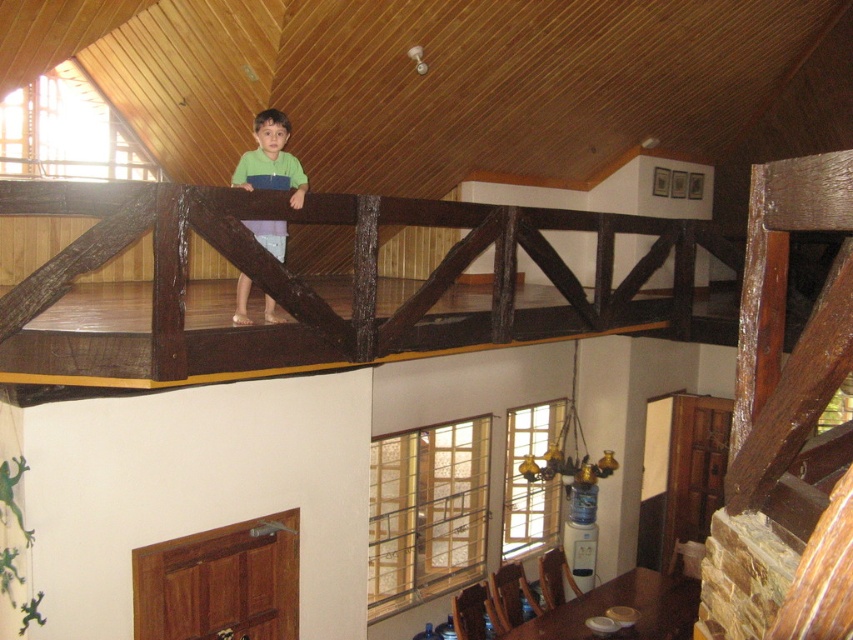
Question: Among these points, which one is farthest from the camera?

Choices:
 (A) (265, 305)
 (B) (392, 216)

Answer: (A)

Question: Can you confirm if dark brown wood at upper center is smaller than green matte shirt at upper center?

Choices:
 (A) yes
 (B) no

Answer: (B)

Question: Can you confirm if dark brown wood at upper center is positioned to the right of green matte shirt at upper center?

Choices:
 (A) no
 (B) yes

Answer: (B)

Question: Which point appears closest to the camera in this image?

Choices:
 (A) (682, 262)
 (B) (268, 144)

Answer: (B)

Question: Which point is farther from the camera taking this photo?

Choices:
 (A) (260, 225)
 (B) (219, 353)

Answer: (A)

Question: Does dark brown wood at upper center have a lesser width compared to green matte shirt at upper center?

Choices:
 (A) no
 (B) yes

Answer: (A)